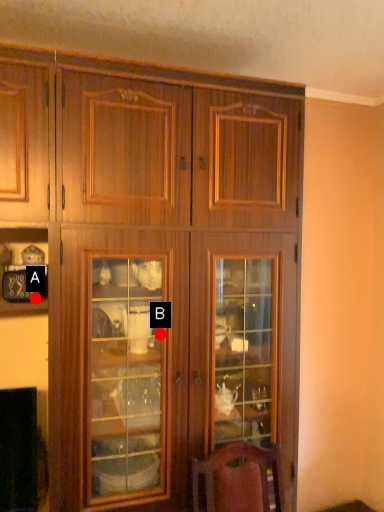
Question: Two points are circled on the image, labeled by A and B beside each circle. Which point appears closest to the camera in this image?

Choices:
 (A) A is closer
 (B) B is closer

Answer: (B)